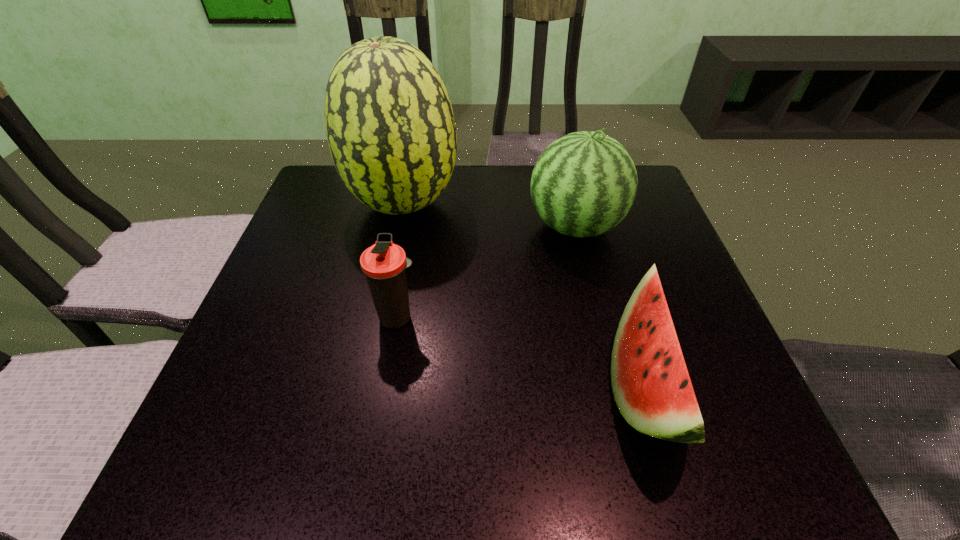
The image size is (960, 540). In the image, there is a desktop. Identify the location of free region at the far left corner. (320, 174).

This screenshot has height=540, width=960. Identify the location of vacant space at the near left corner of the desktop. (233, 445).

This screenshot has width=960, height=540. What are the coordinates of `free space between the tallest watermelon and the nearest watermelon` in the screenshot? It's located at (524, 295).

In order to click on free spot between the thermos bottle and the third shortest object in this screenshot , I will do `click(487, 272)`.

Find the location of `unoccupied area between the third shortest object and the tallest watermelon`. unoccupied area between the third shortest object and the tallest watermelon is located at coordinates (490, 215).

In order to click on vacant region between the shortest watermelon and the thermos bottle in this screenshot , I will do `click(521, 352)`.

Find the location of a particular element. vacant area between the second tallest watermelon and the tallest watermelon is located at coordinates (490, 215).

Where is `empty location between the third shortest object and the leftmost watermelon`? Image resolution: width=960 pixels, height=540 pixels. empty location between the third shortest object and the leftmost watermelon is located at coordinates (490, 215).

Locate an element on the screen. free space that is in between the second tallest watermelon and the tallest watermelon is located at coordinates (490, 215).

Where is `empty space that is in between the shortest watermelon and the leftmost watermelon`? This screenshot has width=960, height=540. empty space that is in between the shortest watermelon and the leftmost watermelon is located at coordinates (524, 295).